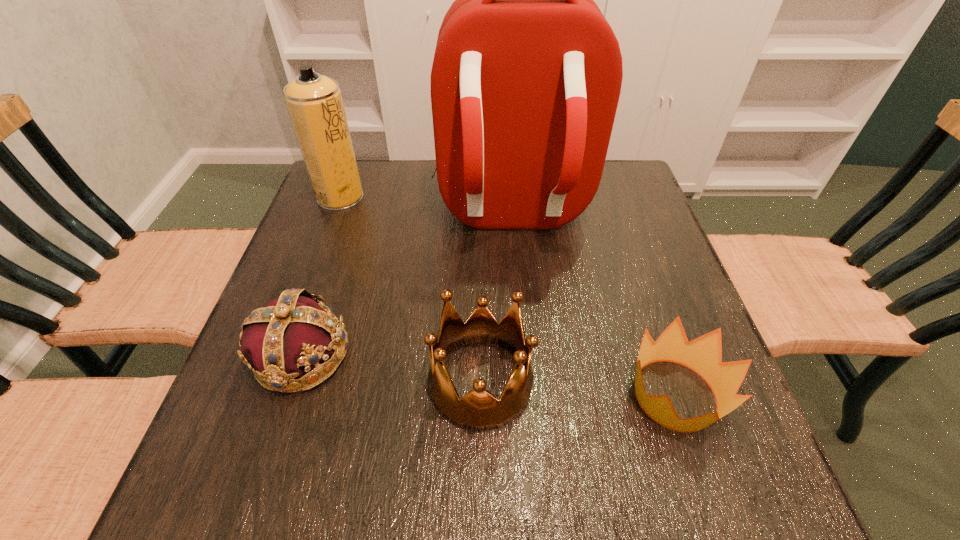
Identify the location of free region at the right edge of the desktop. Image resolution: width=960 pixels, height=540 pixels. (680, 275).

The width and height of the screenshot is (960, 540). I want to click on free space at the near left corner of the desktop, so click(203, 480).

You are a GUI agent. You are given a task and a screenshot of the screen. Output one action in this format:
    pyautogui.click(x=<x>, y=<y>)
    Task: Click on the free location at the far right corner
    
    Given the screenshot: What is the action you would take?
    pyautogui.click(x=626, y=197)

Image resolution: width=960 pixels, height=540 pixels. In the image, there is a desktop. What are the coordinates of `vacant space at the near right corner` in the screenshot? It's located at (711, 490).

I want to click on blank region between the rightmost crown and the tallest crown, so pos(578,388).

Find the location of a particular element. This screenshot has height=540, width=960. free space that is in between the second crown from left to right and the backpack is located at coordinates (495, 298).

Locate an element on the screen. free area in between the third tallest object and the second tallest object is located at coordinates (411, 289).

Where is `free area in between the rightmost crown and the aerosol can`? The height and width of the screenshot is (540, 960). free area in between the rightmost crown and the aerosol can is located at coordinates (508, 296).

The width and height of the screenshot is (960, 540). Identify the location of unoccupied area between the second crown from left to right and the backpack. (495, 298).

Image resolution: width=960 pixels, height=540 pixels. Identify the location of vacant area that lies between the leftmost crown and the second crown from left to right. (391, 368).